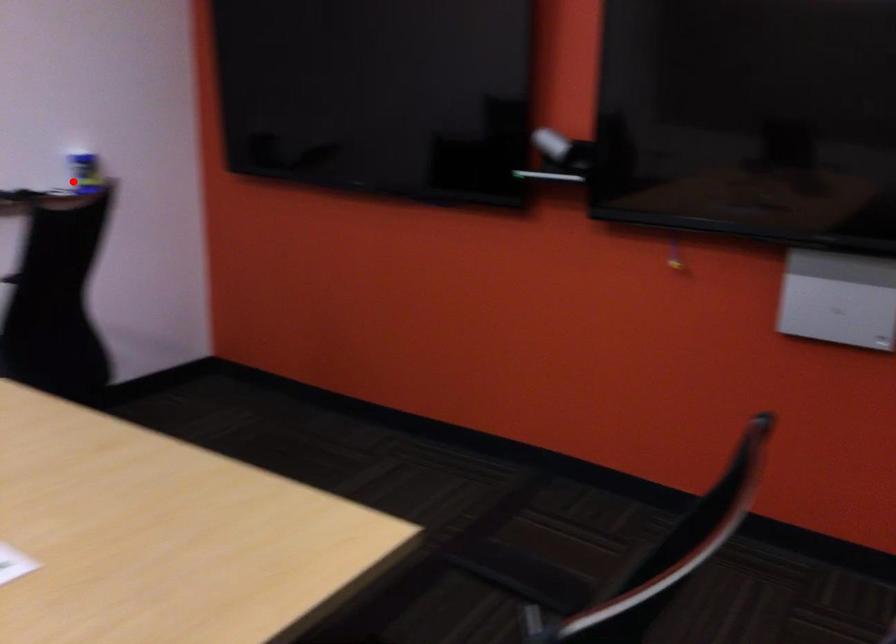
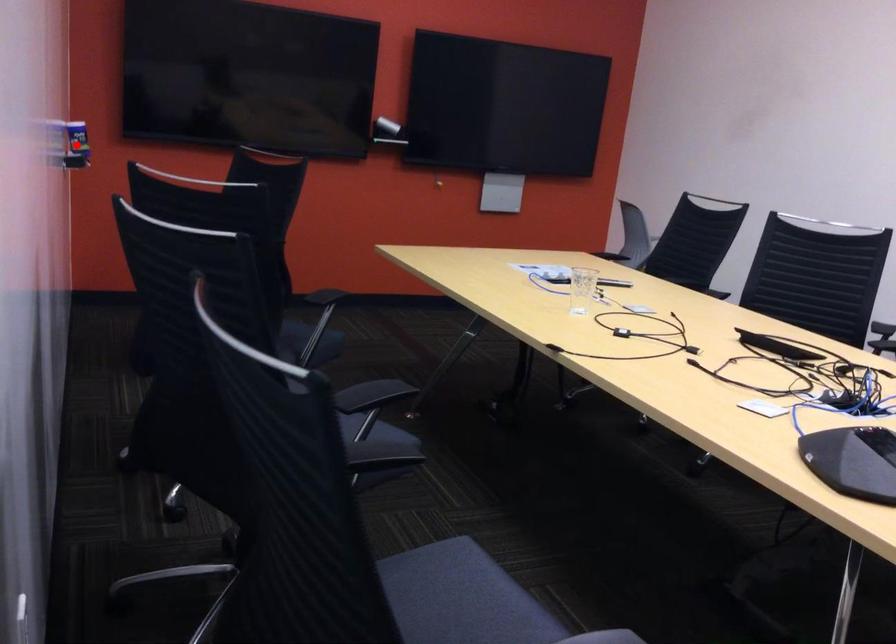
I am providing you with two images of the same scene from different viewpoints. A red point is marked on the first image and another point is marked on the second image. Do the highlighted points in image1 and image2 indicate the same real-world spot?

Yes